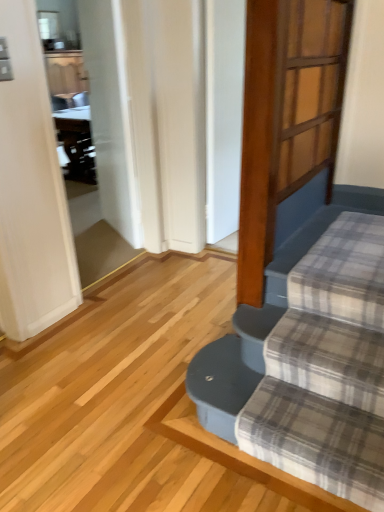
Find the location of a particular element. The height and width of the screenshot is (512, 384). vacant area on top of plaid fabric at lower right (from a real-world perspective) is located at coordinates (304, 408).